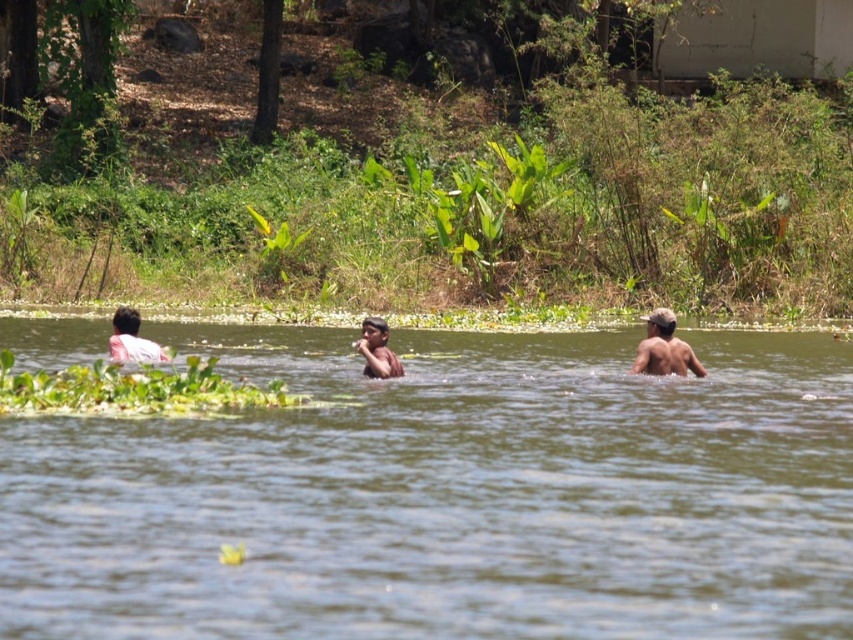
You are a photographer standing on the shore of the water. You want to take a photo that includes both the brown skin at right and the smooth skin person at center. Which person will appear smaller in the photo?

The brown skin at right will appear smaller in the photo because it is thinner than the smooth skin person at center.

You are a photographer trying to capture the scene. You need to place a white cloth at left so that it is wider than the brown murky water at center. Is this possible according to the current arrangement?

The brown murky water at center might be wider than white cloth at left, so it is uncertain if the white cloth at left can be placed to be wider than the brown murky water at center based on the current arrangement.